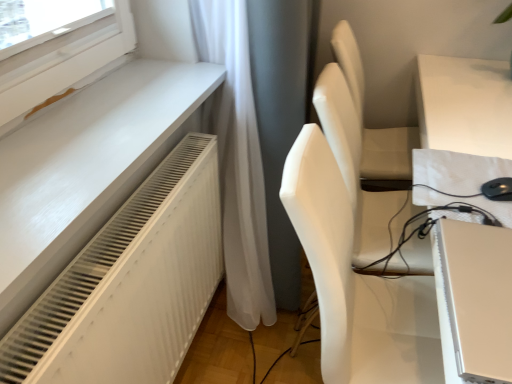
Question: Is white matte chair at center positioned in front of satin gold laptop at lower right?

Choices:
 (A) no
 (B) yes

Answer: (A)

Question: Is white matte chair at center beside satin gold laptop at lower right?

Choices:
 (A) no
 (B) yes

Answer: (A)

Question: Does white matte chair at center lie behind satin gold laptop at lower right?

Choices:
 (A) no
 (B) yes

Answer: (B)

Question: Would you say white matte chair at center is outside satin gold laptop at lower right?

Choices:
 (A) yes
 (B) no

Answer: (A)

Question: Is white matte chair at center thinner than satin gold laptop at lower right?

Choices:
 (A) yes
 (B) no

Answer: (B)

Question: Does white matte chair at center have a smaller size compared to satin gold laptop at lower right?

Choices:
 (A) no
 (B) yes

Answer: (A)

Question: Is matte white table at right positioned in front of white matte chair at center?

Choices:
 (A) no
 (B) yes

Answer: (B)

Question: Is matte white table at right not inside white matte chair at center?

Choices:
 (A) yes
 (B) no

Answer: (A)

Question: Could you tell me if matte white table at right is turned towards white matte chair at center?

Choices:
 (A) no
 (B) yes

Answer: (A)

Question: Does matte white table at right appear on the right side of white matte chair at center?

Choices:
 (A) yes
 (B) no

Answer: (A)

Question: Considering the relative sizes of matte white table at right and white matte chair at center in the image provided, is matte white table at right thinner than white matte chair at center?

Choices:
 (A) yes
 (B) no

Answer: (B)

Question: Does matte white table at right lie behind white matte chair at center?

Choices:
 (A) no
 (B) yes

Answer: (A)

Question: From a real-world perspective, is matte white table at right located higher than satin gold laptop at lower right?

Choices:
 (A) yes
 (B) no

Answer: (B)